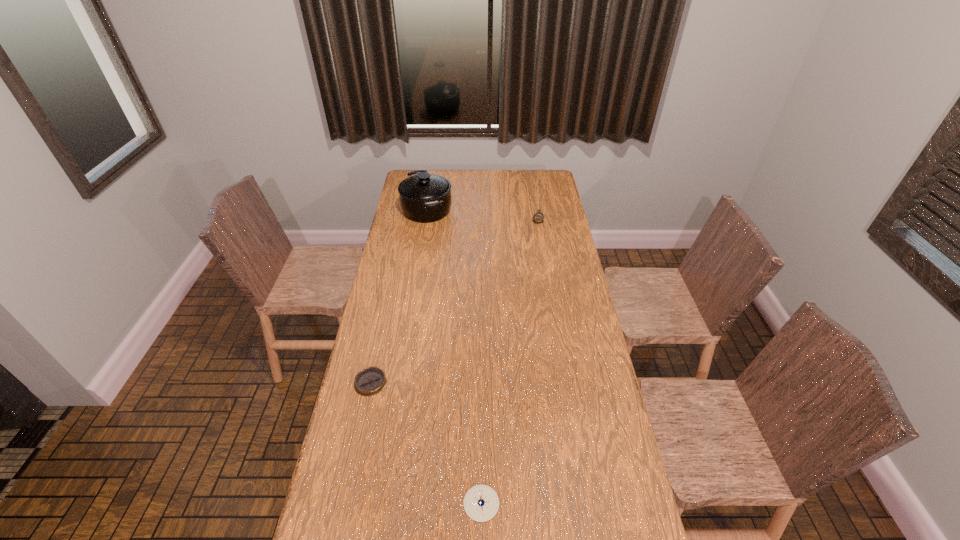
The height and width of the screenshot is (540, 960). In order to click on compass that is the third closest to the saucepan in this screenshot , I will do click(x=481, y=503).

The width and height of the screenshot is (960, 540). Identify the location of compass that is the second closest to the second object from right to left. point(538,217).

Identify the location of free space that satisfies the following two spatial constraints: 1. on the back side of the second nearest object; 2. on the right side of the saucepan. The height and width of the screenshot is (540, 960). (408, 210).

Locate an element on the screen. Image resolution: width=960 pixels, height=540 pixels. vacant point that satisfies the following two spatial constraints: 1. on the front side of the nearest compass; 2. on the right side of the tallest object is located at coordinates (379, 503).